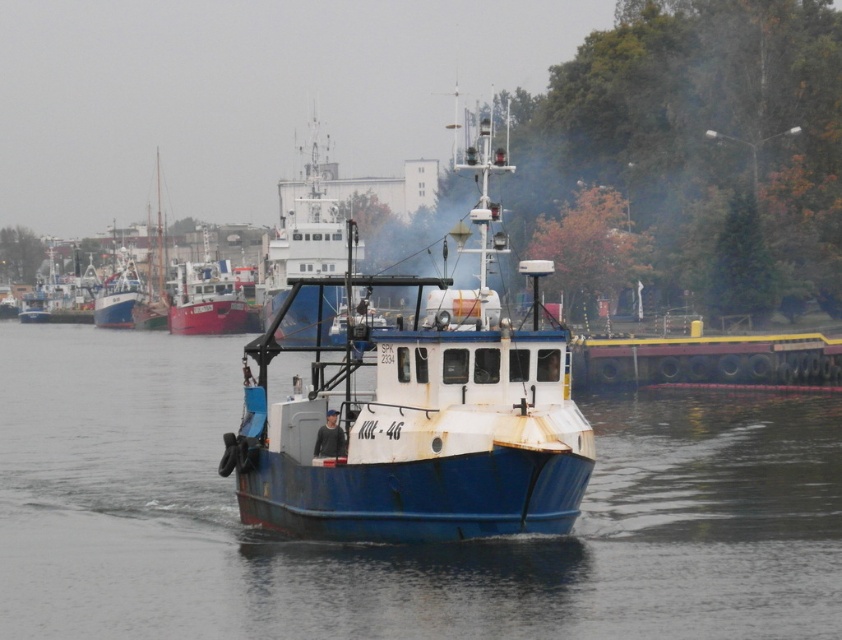
Does point (315, 472) come closer to viewer compared to point (89, 266)?

Yes, point (315, 472) is in front of point (89, 266).

Who is shorter, rusty metal boat at center or rusty metal boat at left?

rusty metal boat at left

What are the coordinates of `rusty metal boat at center` in the screenshot? It's located at click(418, 416).

Is point (242, 296) in front of point (36, 296)?

Yes, it is in front of point (36, 296).

Is rustic wooden ship at center taller than rusty metal boat at left?

Yes.

Measure the distance between point (236,310) and camera.

Point (236,310) and camera are 128.34 meters apart.

Image resolution: width=842 pixels, height=640 pixels. Identify the location of rustic wooden ship at center. (210, 296).

Can you confirm if blue metallic boat at center is smaller than rusty metal boat at center?

Indeed, blue metallic boat at center has a smaller size compared to rusty metal boat at center.

Can you confirm if blue metallic boat at center is positioned above rusty metal boat at center?

No, blue metallic boat at center is not above rusty metal boat at center.

Is point (348, 548) closer to camera compared to point (350, 337)?

Yes.

You are a GUI agent. You are given a task and a screenshot of the screen. Output one action in this format:
    pyautogui.click(x=<x>, y=<y>)
    Task: Click on the blue metallic boat at center
    
    Given the screenshot: What is the action you would take?
    pyautogui.click(x=393, y=547)